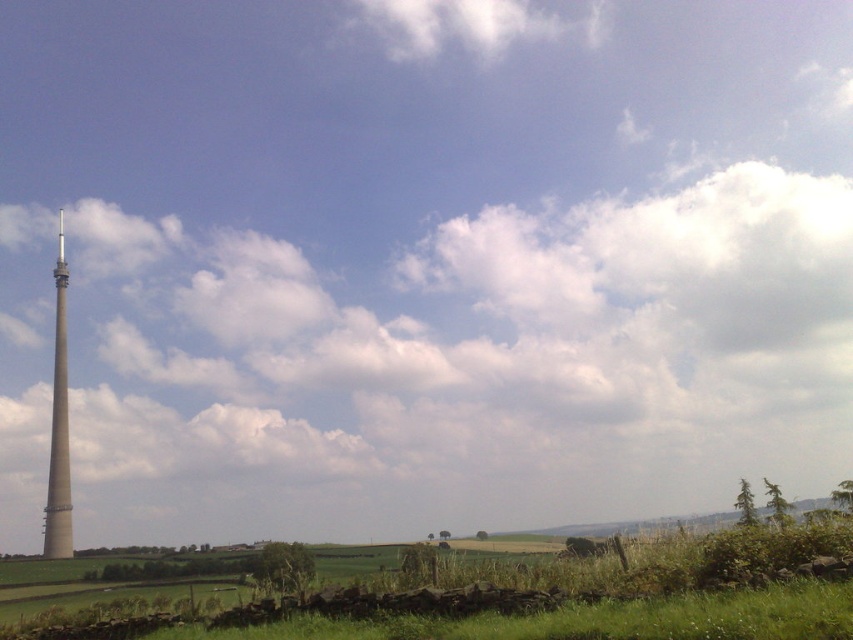
Is green grassy field at lower center taller than beige concrete tower at left?

No.

Between point (634, 554) and point (65, 413), which one is positioned in front?

Point (634, 554) is more forward.

Where is `green grassy field at lower center`? This screenshot has height=640, width=853. green grassy field at lower center is located at coordinates (531, 598).

Which of these two, green grassy field at lower center or smooth white spire at left, stands taller?

smooth white spire at left is taller.

Which is below, green grassy field at lower center or smooth white spire at left?

green grassy field at lower center is lower down.

Who is more forward, [194,625] or [57,256]?

Point [194,625] is more forward.

Find the location of a particular element. This screenshot has width=853, height=640. green grassy field at lower center is located at coordinates (531, 598).

Is beige concrete tower at left to the left of smooth white spire at left from the viewer's perspective?

In fact, beige concrete tower at left is to the right of smooth white spire at left.

Does beige concrete tower at left have a greater height compared to smooth white spire at left?

Yes.

Is point (62, 246) farther from viewer compared to point (62, 230)?

That is False.

The width and height of the screenshot is (853, 640). I want to click on beige concrete tower at left, so click(x=59, y=426).